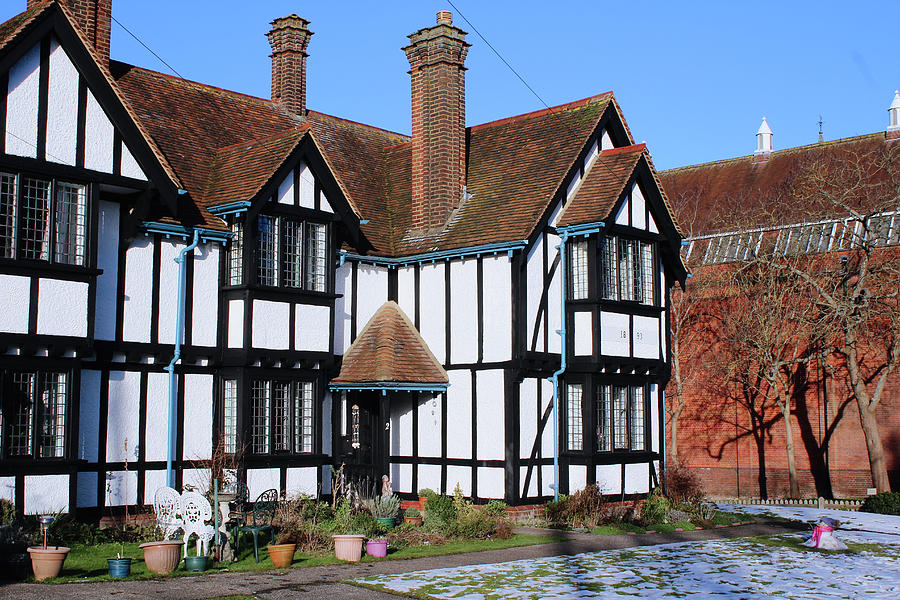
In order to click on chimneys in this screenshot , I will do `click(444, 143)`, `click(290, 80)`, `click(85, 19)`.